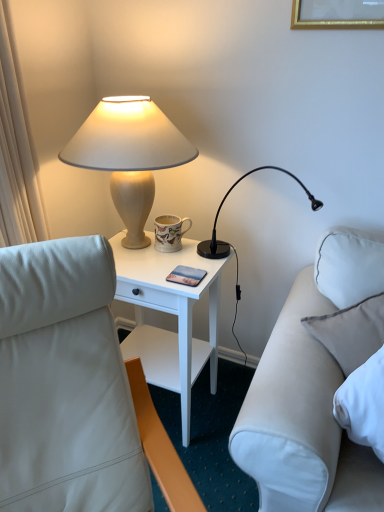
Question: Does matte beige lamp at upper left, the first lamp viewed from the left, have a smaller size compared to white wood nightstand at center?

Choices:
 (A) no
 (B) yes

Answer: (B)

Question: Is matte beige lamp at upper left, the 2th lamp in the right-to-left sequence, bigger than white wood nightstand at center?

Choices:
 (A) yes
 (B) no

Answer: (B)

Question: Considering the relative positions of matte beige lamp at upper left, the first lamp viewed from the left, and white wood nightstand at center in the image provided, is matte beige lamp at upper left, the first lamp viewed from the left, in front of white wood nightstand at center?

Choices:
 (A) no
 (B) yes

Answer: (B)

Question: Does matte beige lamp at upper left, the 2th lamp in the right-to-left sequence, appear on the left side of white wood nightstand at center?

Choices:
 (A) yes
 (B) no

Answer: (A)

Question: Could white wood nightstand at center be considered to be inside matte beige lamp at upper left, the first lamp viewed from the left?

Choices:
 (A) yes
 (B) no

Answer: (B)

Question: Considering their positions, is matte beige lamp at upper left, the 2th lamp in the right-to-left sequence, located in front of or behind black plastic desk lamp at upper right, the 2th lamp positioned from the left?

Choices:
 (A) front
 (B) behind

Answer: (A)

Question: Considering the positions of matte beige lamp at upper left, the 2th lamp in the right-to-left sequence, and black plastic desk lamp at upper right, the 2th lamp positioned from the left, in the image, is matte beige lamp at upper left, the 2th lamp in the right-to-left sequence, wider or thinner than black plastic desk lamp at upper right, the 2th lamp positioned from the left,?

Choices:
 (A) wide
 (B) thin

Answer: (B)

Question: From their relative heights in the image, would you say matte beige lamp at upper left, the first lamp viewed from the left, is taller or shorter than black plastic desk lamp at upper right, the 2th lamp positioned from the left?

Choices:
 (A) tall
 (B) short

Answer: (B)

Question: From a real-world perspective, relative to black plastic desk lamp at upper right, the 2th lamp positioned from the left, is matte beige lamp at upper left, the first lamp viewed from the left, vertically above or below?

Choices:
 (A) above
 (B) below

Answer: (A)

Question: Does point (306, 192) appear closer or farther from the camera than point (132, 240)?

Choices:
 (A) farther
 (B) closer

Answer: (A)

Question: Considering the positions of black plastic desk lamp at upper right, acting as the 1th lamp starting from the right, and matte beige lamp at upper left, the first lamp viewed from the left, in the image, is black plastic desk lamp at upper right, acting as the 1th lamp starting from the right, wider or thinner than matte beige lamp at upper left, the first lamp viewed from the left,?

Choices:
 (A) wide
 (B) thin

Answer: (A)

Question: Looking at the image, does black plastic desk lamp at upper right, acting as the 1th lamp starting from the right, seem bigger or smaller compared to matte beige lamp at upper left, the first lamp viewed from the left?

Choices:
 (A) small
 (B) big

Answer: (A)

Question: From the image's perspective, is black plastic desk lamp at upper right, the 2th lamp positioned from the left, positioned above or below matte beige lamp at upper left, the 2th lamp in the right-to-left sequence?

Choices:
 (A) above
 (B) below

Answer: (B)

Question: Is point (304, 275) closer or farther from the camera than point (236, 287)?

Choices:
 (A) farther
 (B) closer

Answer: (B)

Question: From their relative heights in the image, would you say white leather studio couch at right is taller or shorter than black plastic desk lamp at upper right, the 2th lamp positioned from the left?

Choices:
 (A) tall
 (B) short

Answer: (A)